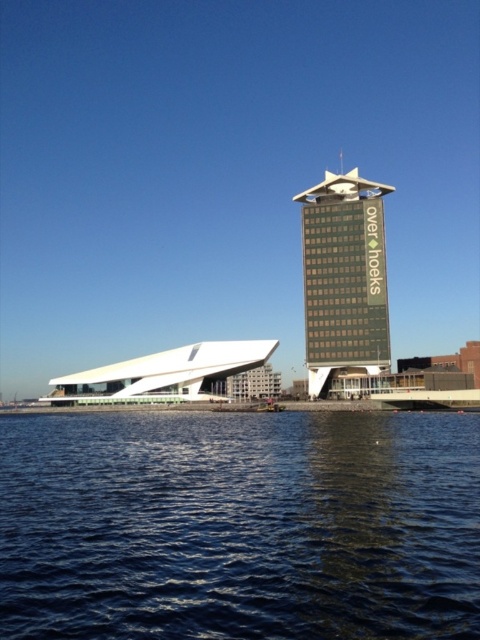
Question: Which of the following is the closest to the observer?

Choices:
 (A) green glass building at center
 (B) dark blue water at lower center

Answer: (B)

Question: Can you confirm if dark blue water at lower center is smaller than green glass building at center?

Choices:
 (A) yes
 (B) no

Answer: (B)

Question: Which of the following is the closest to the observer?

Choices:
 (A) green glass building at center
 (B) dark blue water at lower center

Answer: (B)

Question: Can you confirm if dark blue water at lower center is positioned to the right of green glass building at center?

Choices:
 (A) yes
 (B) no

Answer: (B)

Question: Does dark blue water at lower center have a smaller size compared to green glass building at center?

Choices:
 (A) yes
 (B) no

Answer: (B)

Question: Among these objects, which one is nearest to the camera?

Choices:
 (A) dark blue water at lower center
 (B) green glass building at center

Answer: (A)